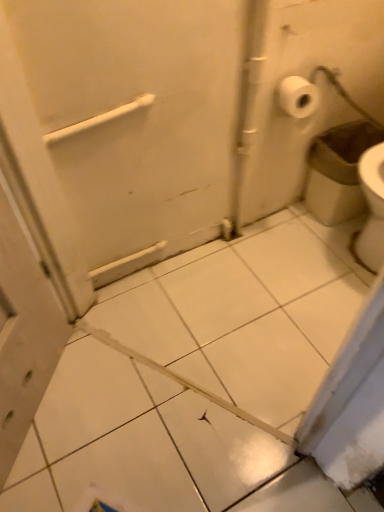
Question: From a real-world perspective, is white plastic trash can at right on top of white plastic towel bar at upper center?

Choices:
 (A) no
 (B) yes

Answer: (A)

Question: Considering the relative sizes of white plastic trash can at right and white plastic towel bar at upper center in the image provided, is white plastic trash can at right wider than white plastic towel bar at upper center?

Choices:
 (A) yes
 (B) no

Answer: (A)

Question: Is white plastic trash can at right outside of white plastic towel bar at upper center?

Choices:
 (A) yes
 (B) no

Answer: (A)

Question: From a real-world perspective, is white plastic trash can at right below white plastic towel bar at upper center?

Choices:
 (A) yes
 (B) no

Answer: (A)

Question: Is white plastic trash can at right next to white plastic towel bar at upper center?

Choices:
 (A) no
 (B) yes

Answer: (A)

Question: Is white plastic trash can at right to the left of white plastic towel bar at upper center from the viewer's perspective?

Choices:
 (A) no
 (B) yes

Answer: (A)

Question: Is white plastic towel bar at upper center smaller than white plastic trash can at right?

Choices:
 (A) yes
 (B) no

Answer: (A)

Question: From a real-world perspective, is white plastic towel bar at upper center beneath white plastic trash can at right?

Choices:
 (A) no
 (B) yes

Answer: (A)

Question: Is white plastic towel bar at upper center at the right side of white plastic trash can at right?

Choices:
 (A) no
 (B) yes

Answer: (A)

Question: Is white plastic towel bar at upper center at the left side of white plastic trash can at right?

Choices:
 (A) yes
 (B) no

Answer: (A)

Question: Does white plastic towel bar at upper center come in front of white plastic trash can at right?

Choices:
 (A) yes
 (B) no

Answer: (A)

Question: Is white plastic towel bar at upper center far from white plastic trash can at right?

Choices:
 (A) yes
 (B) no

Answer: (B)

Question: Based on their positions, is white plastic towel bar at upper center located to the left or right of white plastic trash can at right?

Choices:
 (A) right
 (B) left

Answer: (B)